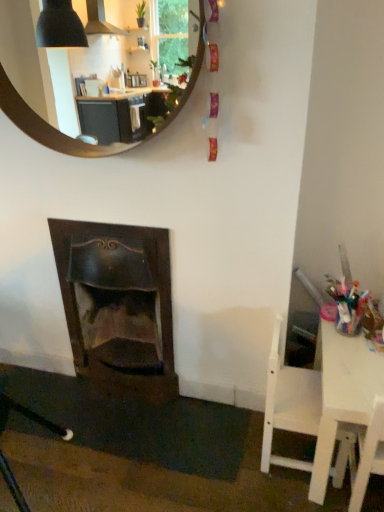
This screenshot has width=384, height=512. I want to click on vacant area on top of white plastic table at right (from a real-world perspective), so click(354, 353).